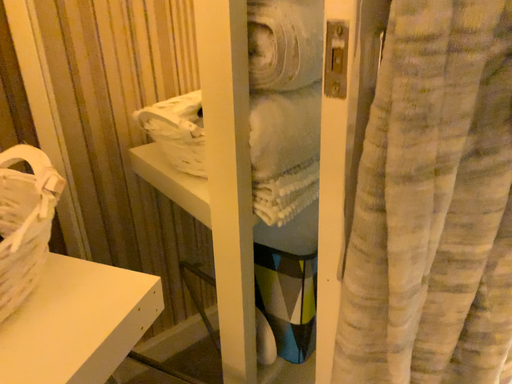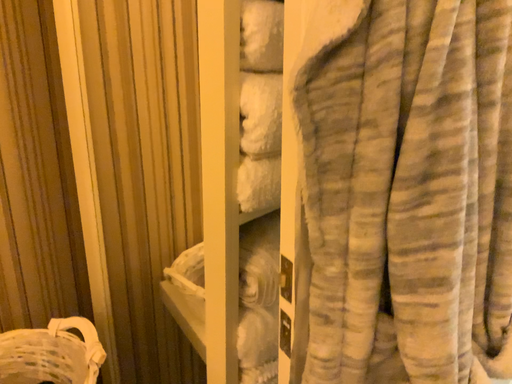
Question: How did the camera likely rotate when shooting the video?

Choices:
 (A) rotated upward
 (B) rotated downward

Answer: (A)